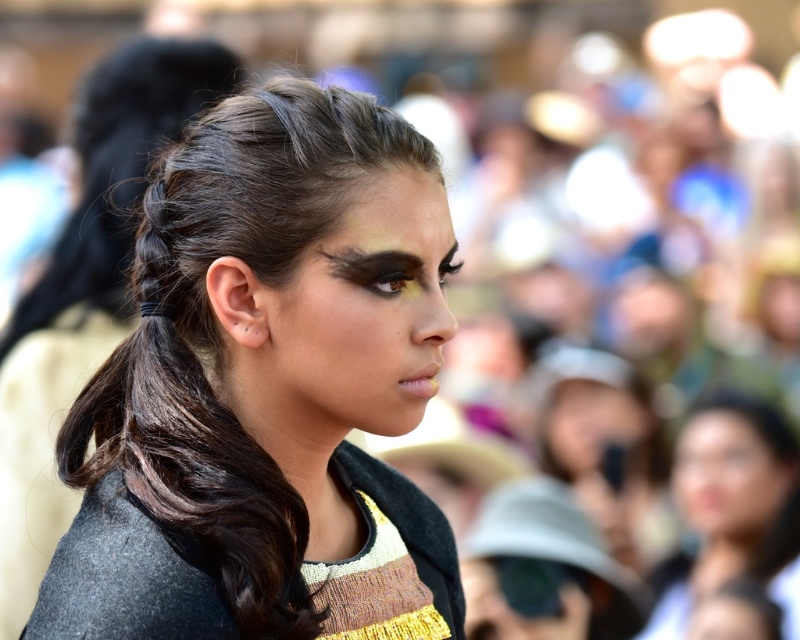
You are a photographer trying to capture a portrait of the matte black face at center and the dark brown braided hair at center. Given that your camera has a depth of field that can focus on objects within a 1.5 meter range, will both subjects be in focus?

The matte black face at center and dark brown braided hair at center are 1.67 meters apart. Since the distance between them exceeds the camera lens depth of field range of 1.5 meters, only one of them will be in focus while the other remains blurred.

You are a photographer standing at a certain distance from the subject. You want to capture a closeup shot of the matte black hair at center. Given that the camera you are using has a minimum focusing distance of 5 feet, will you be able to take the photo without moving closer?

The matte black hair at center is 5.39 feet away from viewer. Since the minimum focusing distance is 5 feet, you are within range and can take the photo without moving closer.